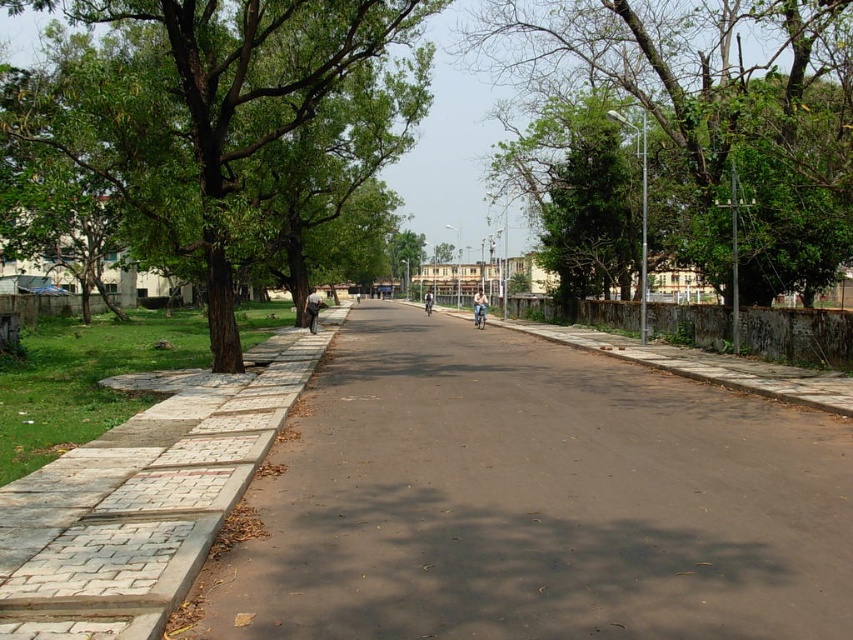
Question: Is the position of dark blue jeans at center more distant than that of green leafy tree at center?

Choices:
 (A) yes
 (B) no

Answer: (B)

Question: Which of the following is the farthest from the observer?

Choices:
 (A) (689, 177)
 (B) (476, 316)

Answer: (B)

Question: Is green leafy tree at upper right below light blue jeans at center?

Choices:
 (A) yes
 (B) no

Answer: (B)

Question: Can you confirm if green leafy tree at upper right is positioned above light blue fabric jacket at center?

Choices:
 (A) no
 (B) yes

Answer: (B)

Question: Which object is positioned closest to the light gray concrete sidewalk at left?

Choices:
 (A) green leafy tree at upper right
 (B) green leafy tree at left
 (C) green leafy tree at center

Answer: (B)

Question: Estimate the real-world distances between objects in this image. Which object is closer to the light gray concrete sidewalk at left?

Choices:
 (A) light blue jeans at center
 (B) green leafy tree at center

Answer: (A)